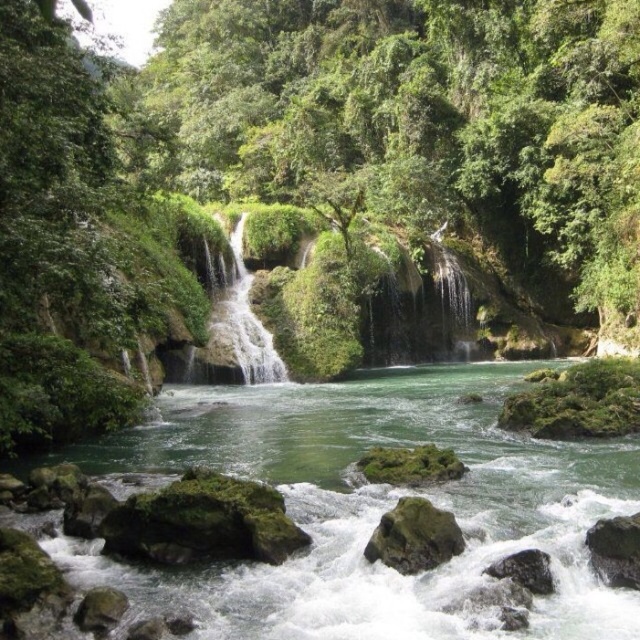
Can you confirm if clear water at center is positioned above green mossy rock at lower right?

Yes, clear water at center is above green mossy rock at lower right.

Is clear water at center taller than green mossy rock at lower right?

Correct, clear water at center is much taller as green mossy rock at lower right.

This screenshot has width=640, height=640. I want to click on clear water at center, so click(x=230, y=336).

Who is taller, clear water at center or green mossy rock at center?

Standing taller between the two is clear water at center.

Is the position of clear water at center less distant than that of green mossy rock at center?

That is False.

You are a GUI agent. You are given a task and a screenshot of the screen. Output one action in this format:
    pyautogui.click(x=<x>, y=<y>)
    Task: Click on the clear water at center
    Image resolution: width=640 pixels, height=640 pixels.
    Given the screenshot: What is the action you would take?
    [x=230, y=336]

What do you see at coordinates (413, 536) in the screenshot? The height and width of the screenshot is (640, 640). I see `green mossy rock at center` at bounding box center [413, 536].

Can you confirm if green mossy rock at center is wider than gray rough rock at lower right?

Yes.

Which is behind, point (394, 522) or point (525, 577)?

The point (394, 522) is more distant.

Where is `green mossy rock at center`? The width and height of the screenshot is (640, 640). green mossy rock at center is located at coordinates (413, 536).